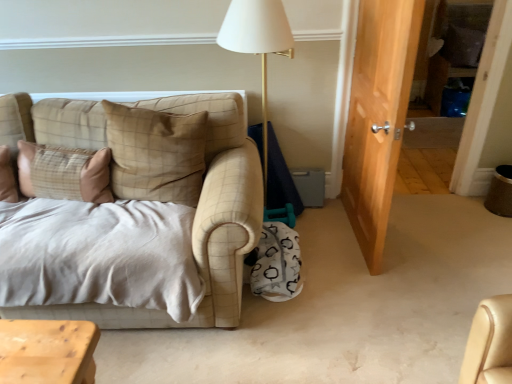
What do you see at coordinates (156, 154) in the screenshot? The width and height of the screenshot is (512, 384). I see `beige plaid pillow at upper left` at bounding box center [156, 154].

You are a GUI agent. You are given a task and a screenshot of the screen. Output one action in this format:
    pyautogui.click(x=<x>, y=<y>)
    Task: Click on the beige plaid pillow at upper left
    This screenshot has height=384, width=512.
    Given the screenshot: What is the action you would take?
    pyautogui.click(x=156, y=154)

You are a GUI agent. You are given a task and a screenshot of the screen. Output one action in this format:
    pyautogui.click(x=<x>, y=<y>)
    Task: Click on the beige plaid pillow at upper left
    Image resolution: width=512 pixels, height=384 pixels.
    Given the screenshot: What is the action you would take?
    pyautogui.click(x=156, y=154)